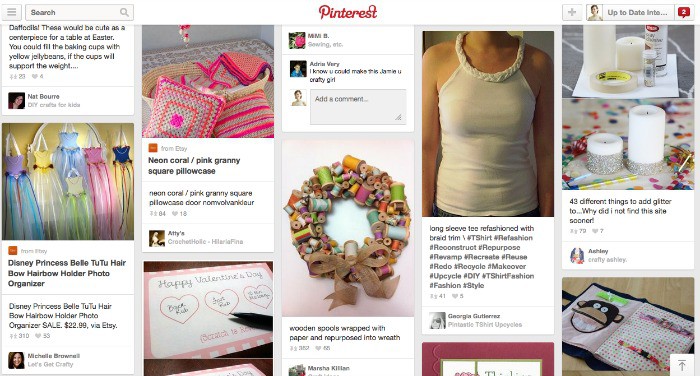
The image size is (700, 376). Find the location of `light gray wall`. light gray wall is located at coordinates pyautogui.click(x=195, y=32).